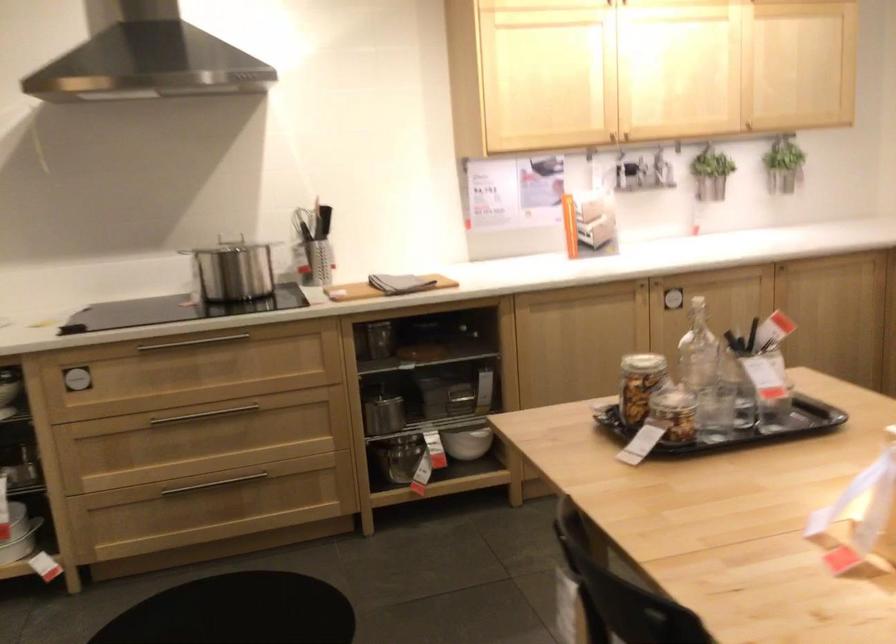
What do you see at coordinates (186, 245) in the screenshot?
I see `the pot side handle` at bounding box center [186, 245].